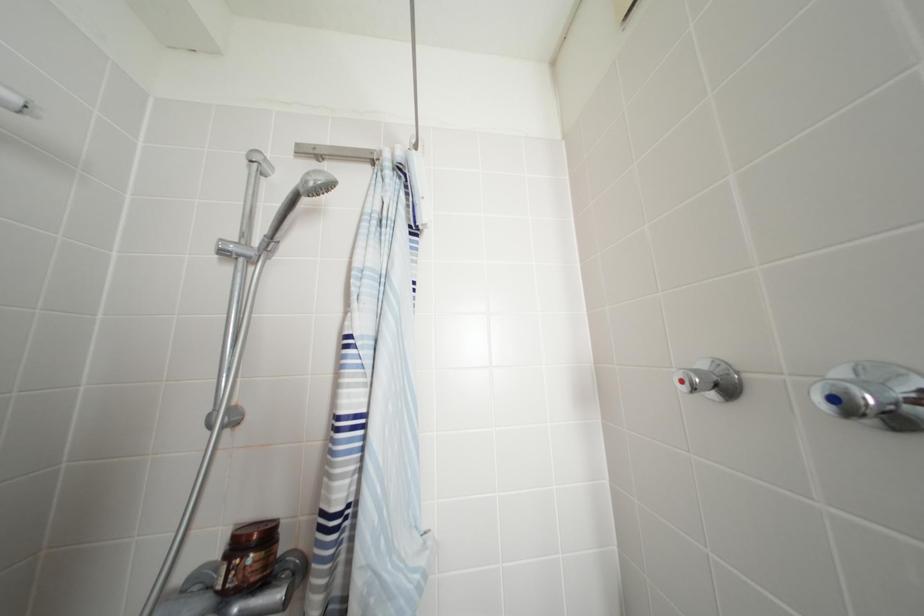
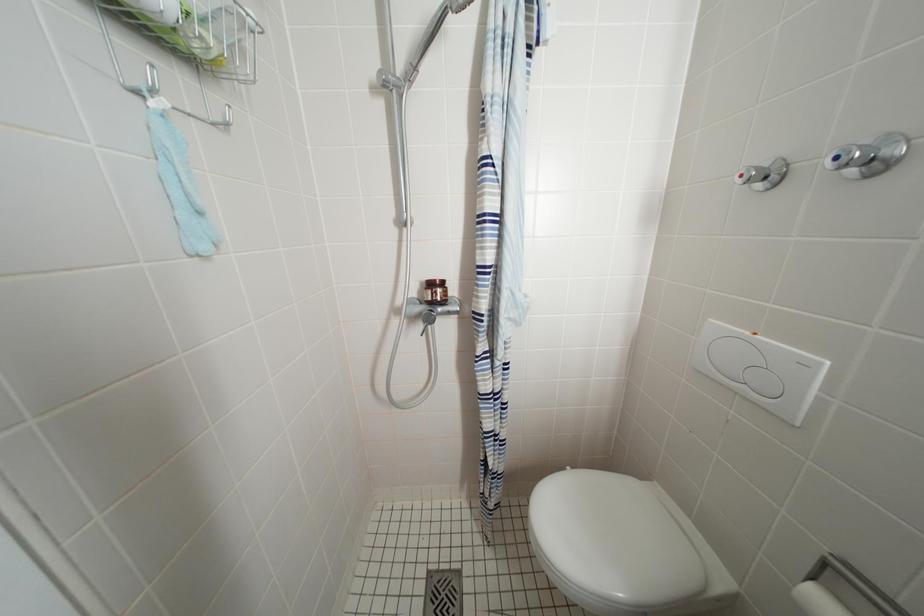
What movement of the cameraman would produce the second image?

The cameraman walked toward left, backward.